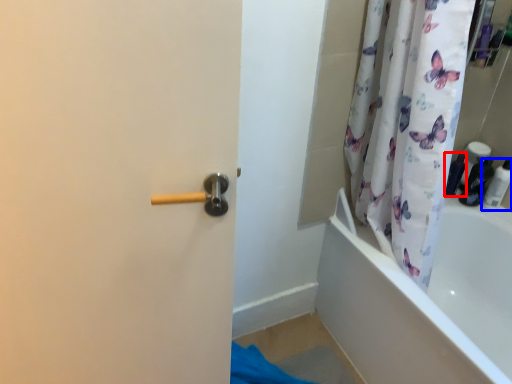
Question: Which of the following is the closest to the observer, toiletry (highlighted by a red box) or toiletry (highlighted by a blue box)?

Choices:
 (A) toiletry
 (B) toiletry

Answer: (B)